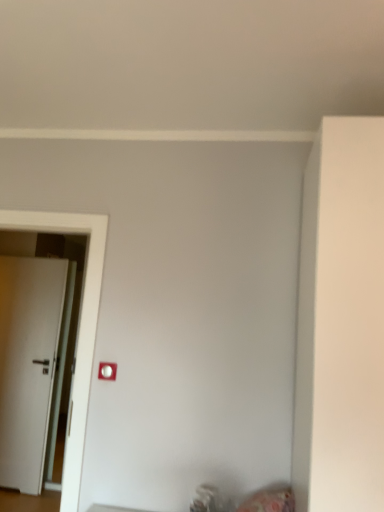
Question: From the image's perspective, is white matte door at left positioned above or below white plastic light switch at center?

Choices:
 (A) below
 (B) above

Answer: (A)

Question: Is white matte door at left inside or outside of white plastic light switch at center?

Choices:
 (A) outside
 (B) inside

Answer: (A)

Question: Based on their positions, is white matte door at left located to the left or right of white plastic light switch at center?

Choices:
 (A) right
 (B) left

Answer: (B)

Question: In the image, is white plastic light switch at center on the left side or the right side of white matte door at left?

Choices:
 (A) left
 (B) right

Answer: (B)

Question: From a real-world perspective, is white plastic light switch at center physically located above or below white matte door at left?

Choices:
 (A) below
 (B) above

Answer: (B)

Question: Considering the positions of white plastic light switch at center and white matte door at left in the image, is white plastic light switch at center wider or thinner than white matte door at left?

Choices:
 (A) wide
 (B) thin

Answer: (B)

Question: In terms of height, does white plastic light switch at center look taller or shorter compared to white matte door at left?

Choices:
 (A) tall
 (B) short

Answer: (B)